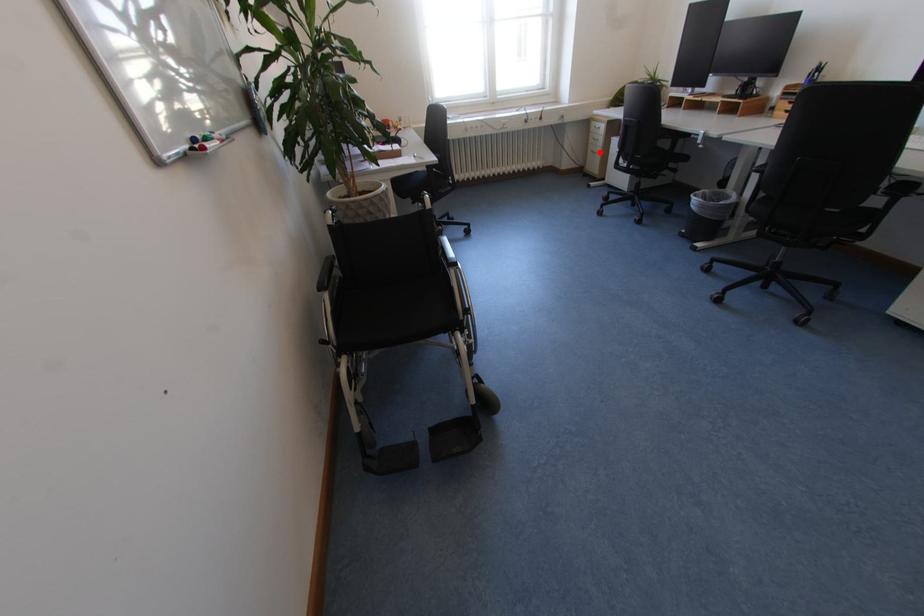
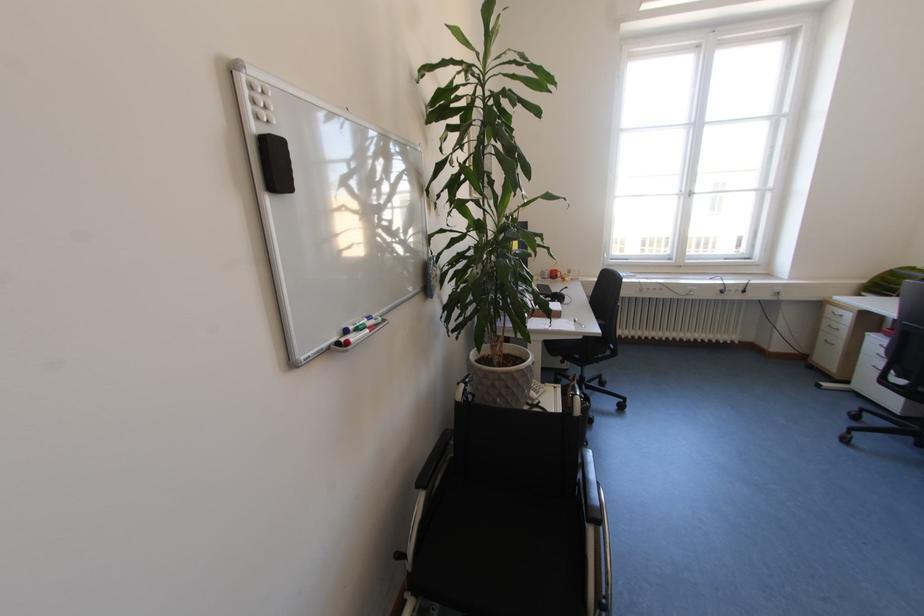
Question: I am providing you with two images of the same scene from different viewpoints. Image1 has a red point marked. In image2, the corresponding 3D location appears at what relative position? Reply with the corresponding letter.

Choices:
 (A) Closer
 (B) Farther

Answer: (B)